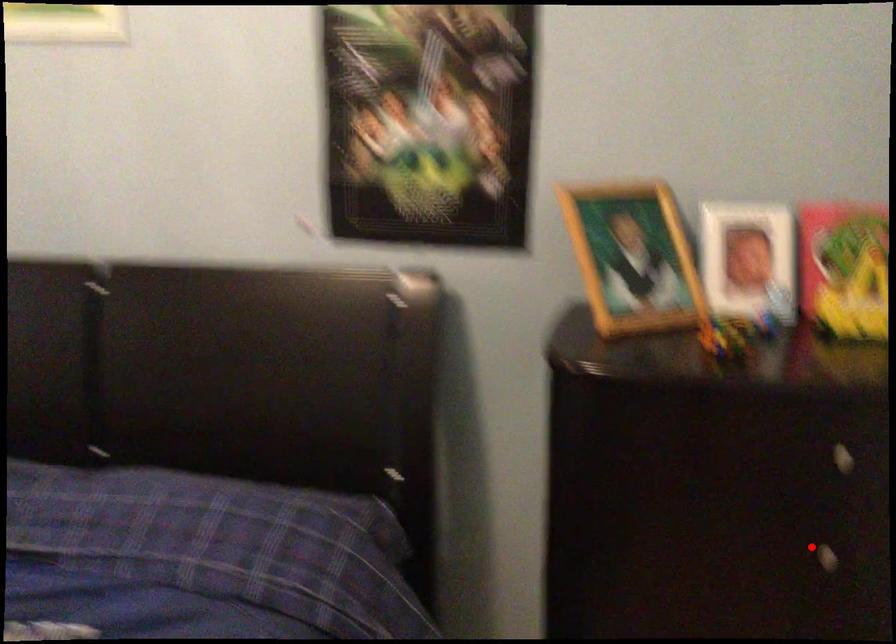
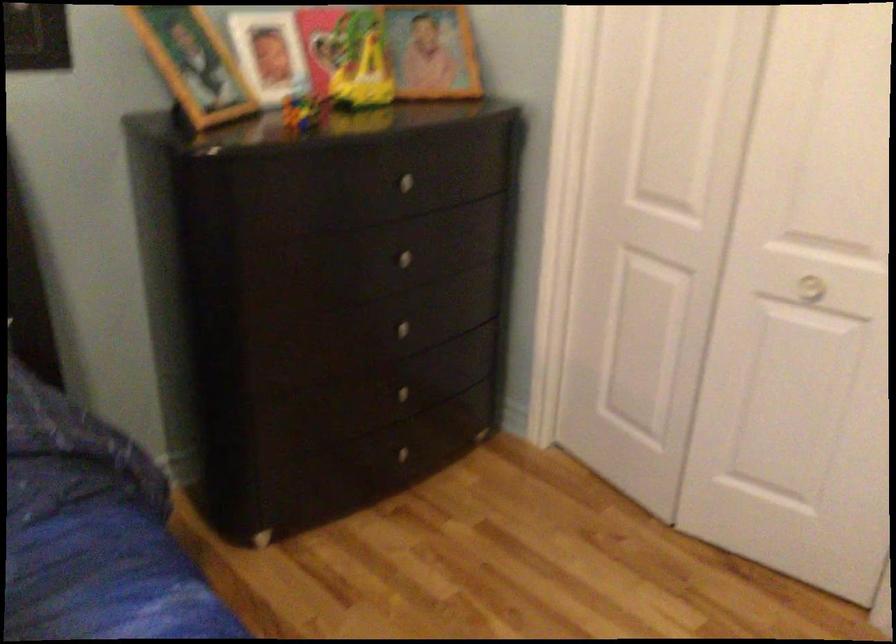
Question: I am providing you with two images of the same scene from different viewpoints. In image1, a red point is highlighted. Considering the same 3D point in image2, which of the following is correct?

Choices:
 (A) It is closer
 (B) It is farther

Answer: (B)